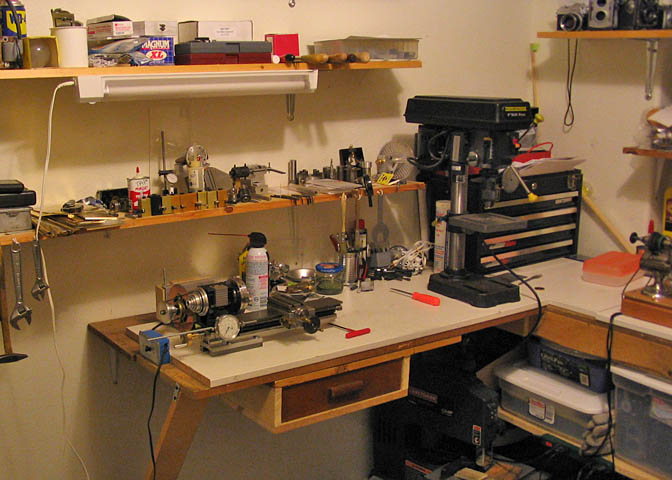
Locate an element on the screen. The width and height of the screenshot is (672, 480). white wall is located at coordinates (478, 62).